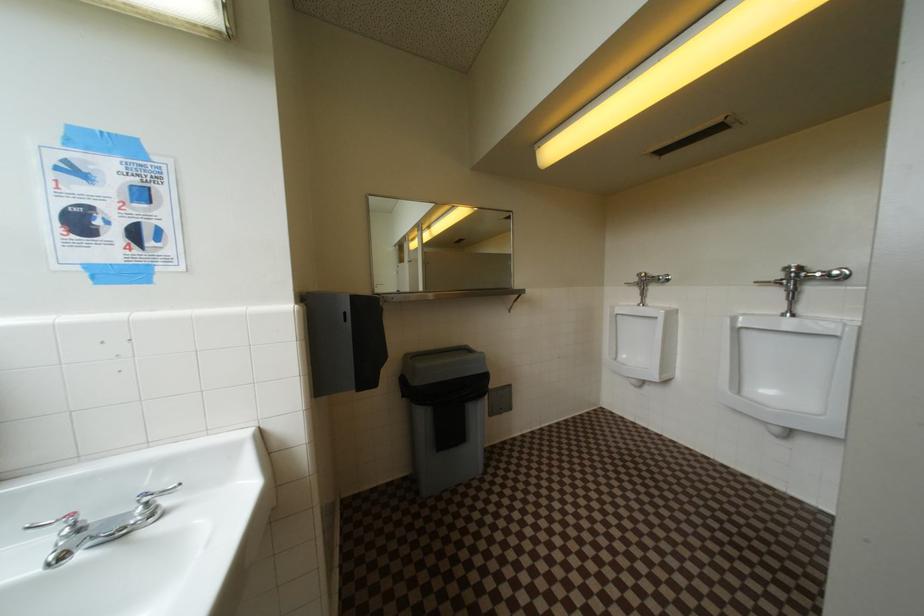
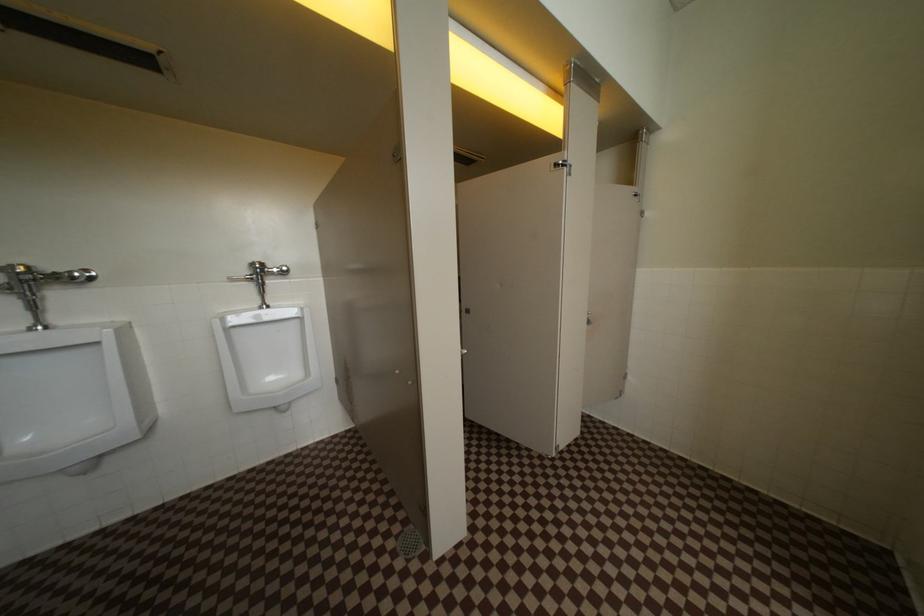
Question: The camera is either moving clockwise (left) or counter-clockwise (right) around the object. The first image is from the beginning of the video and the second image is from the end. Is the camera moving left or right when shooting the video?

Choices:
 (A) Left
 (B) Right

Answer: (A)